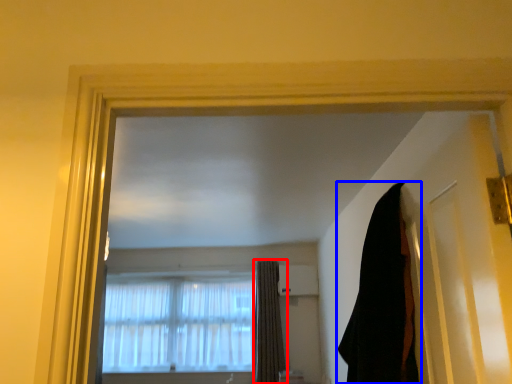
Question: Which object appears closest to the camera in this image, curtain (highlighted by a red box) or curtain (highlighted by a blue box)?

Choices:
 (A) curtain
 (B) curtain

Answer: (B)